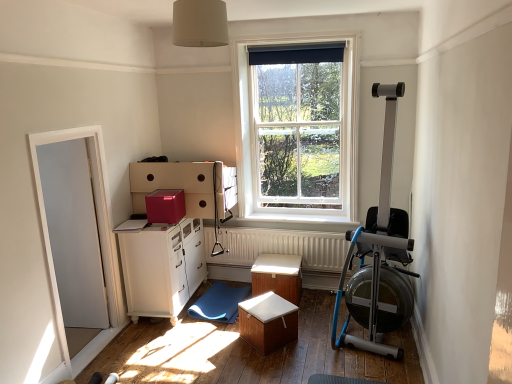
Question: From the image's perspective, is white glossy cabinet at lower left on wooden table at center, the first table positioned from the front?

Choices:
 (A) yes
 (B) no

Answer: (A)

Question: Considering the relative positions of white glossy cabinet at lower left and wooden table at center, which appears as the 2th table when viewed from the back, in the image provided, is white glossy cabinet at lower left behind wooden table at center, which appears as the 2th table when viewed from the back,?

Choices:
 (A) no
 (B) yes

Answer: (B)

Question: Can we say white glossy cabinet at lower left lies outside wooden table at center, which appears as the 2th table when viewed from the back?

Choices:
 (A) no
 (B) yes

Answer: (B)

Question: Does white glossy cabinet at lower left have a greater width compared to wooden table at center, which appears as the 2th table when viewed from the back?

Choices:
 (A) yes
 (B) no

Answer: (A)

Question: Is white glossy cabinet at lower left in contact with wooden table at center, which appears as the 2th table when viewed from the back?

Choices:
 (A) no
 (B) yes

Answer: (A)

Question: Based on their sizes in the image, would you say wooden table at center, which appears as the 2th table when viewed from the back, is bigger or smaller than matte pink cardboard box at upper center?

Choices:
 (A) big
 (B) small

Answer: (A)

Question: Considering their positions, is wooden table at center, which appears as the 2th table when viewed from the back, located in front of or behind matte pink cardboard box at upper center?

Choices:
 (A) front
 (B) behind

Answer: (A)

Question: From a real-world perspective, is wooden table at center, which appears as the 2th table when viewed from the back, positioned above or below matte pink cardboard box at upper center?

Choices:
 (A) above
 (B) below

Answer: (B)

Question: Is wooden table at center, which appears as the 2th table when viewed from the back, wider or thinner than matte pink cardboard box at upper center?

Choices:
 (A) wide
 (B) thin

Answer: (A)

Question: From a real-world perspective, is white wooden window at center above or below blue rubber mat at lower center?

Choices:
 (A) above
 (B) below

Answer: (A)

Question: Considering the positions of point (318, 158) and point (224, 294), is point (318, 158) closer or farther from the camera than point (224, 294)?

Choices:
 (A) farther
 (B) closer

Answer: (A)

Question: Considering their positions, is white wooden window at center located in front of or behind blue rubber mat at lower center?

Choices:
 (A) front
 (B) behind

Answer: (B)

Question: Considering the positions of white wooden window at center and blue rubber mat at lower center in the image, is white wooden window at center taller or shorter than blue rubber mat at lower center?

Choices:
 (A) tall
 (B) short

Answer: (A)

Question: From the image's perspective, is wooden table at center, the first table positioned from the front, located above or below white wooden window at center?

Choices:
 (A) above
 (B) below

Answer: (B)

Question: Relative to white wooden window at center, is wooden table at center, which appears as the 2th table when viewed from the back, in front or behind?

Choices:
 (A) behind
 (B) front

Answer: (B)